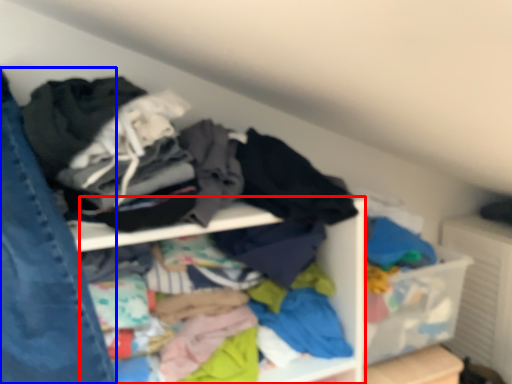
Question: Among these objects, which one is nearest to the camera, cabinet (highlighted by a red box) or jeans (highlighted by a blue box)?

Choices:
 (A) cabinet
 (B) jeans

Answer: (B)